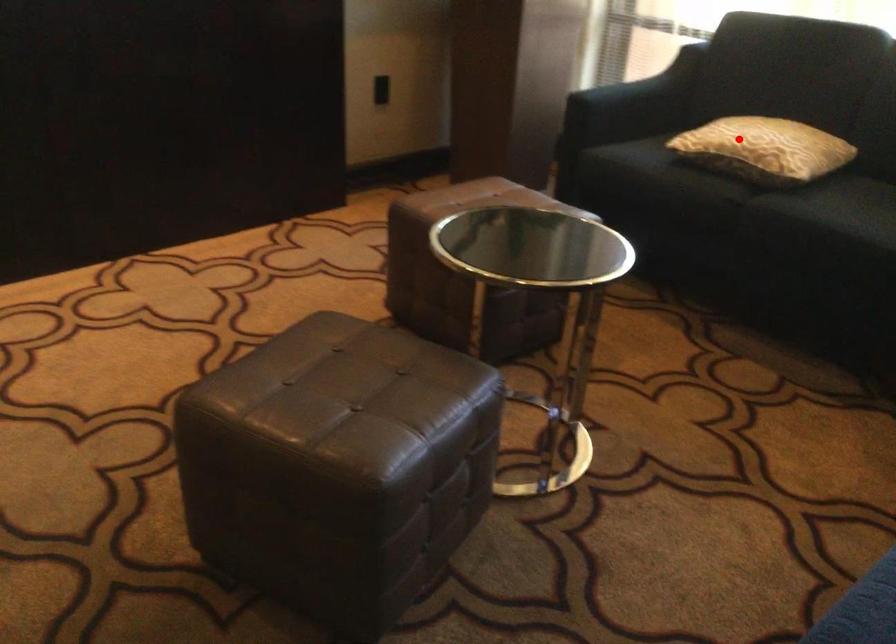
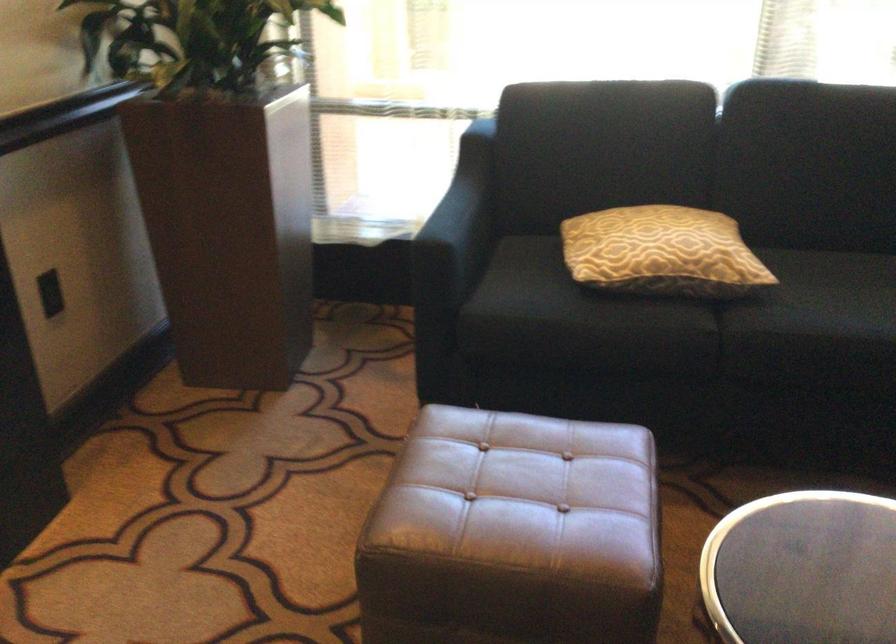
Where in the second image is the point corresponding to the highlighted location from the first image?

(661, 252)